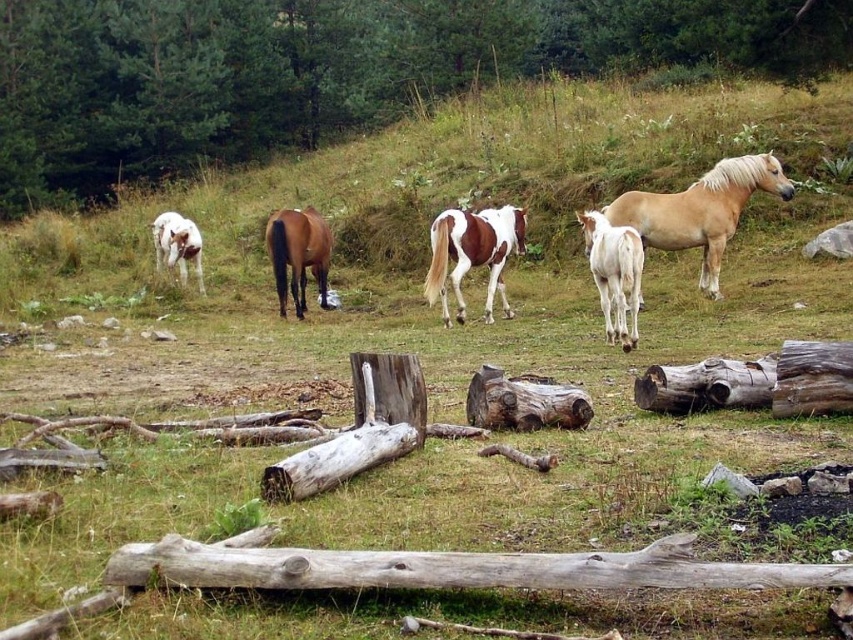
You are a farmer standing in the field and want to place a new fence post between the painted wood horse at center and the white glossy pony at left. Which horse should the fence post be closer to if it needs to be placed closer to the larger animal?

The painted wood horse at center is larger than the white glossy pony at left, so the fence post should be placed closer to the painted wood horse at center.

You are a small animal trying to climb over the brown wood log at center and the gray rough log at lower center. Which log would be harder to climb over?

The brown wood log at center is much taller than the gray rough log at lower center, so it would be harder to climb over.